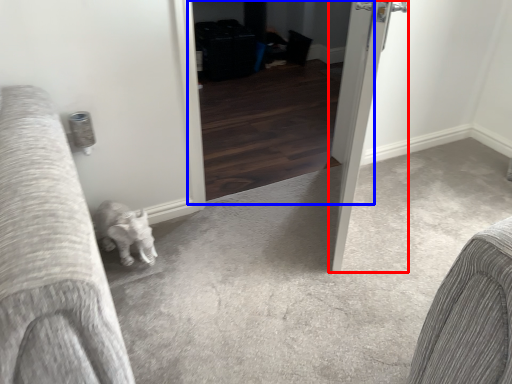
Question: Among these objects, which one is nearest to the camera, door (highlighted by a red box) or screen door (highlighted by a blue box)?

Choices:
 (A) door
 (B) screen door

Answer: (A)